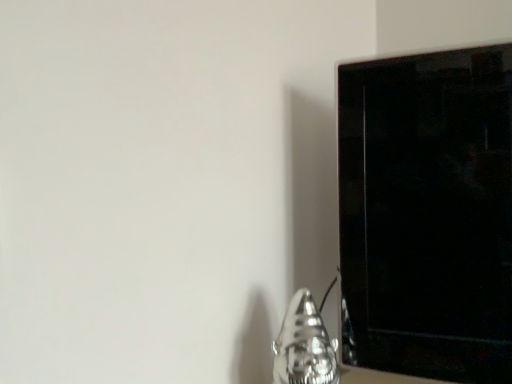
Question: Is shiny metallic gnome at lower right located within black glossy tv at right?

Choices:
 (A) no
 (B) yes

Answer: (A)

Question: Does black glossy tv at right turn towards shiny metallic gnome at lower right?

Choices:
 (A) no
 (B) yes

Answer: (B)

Question: Is black glossy tv at right further to camera compared to shiny metallic gnome at lower right?

Choices:
 (A) yes
 (B) no

Answer: (A)

Question: Can you confirm if black glossy tv at right is positioned to the left of shiny metallic gnome at lower right?

Choices:
 (A) yes
 (B) no

Answer: (B)

Question: Considering the relative sizes of black glossy tv at right and shiny metallic gnome at lower right in the image provided, is black glossy tv at right shorter than shiny metallic gnome at lower right?

Choices:
 (A) yes
 (B) no

Answer: (B)

Question: Considering the relative sizes of black glossy tv at right and shiny metallic gnome at lower right in the image provided, is black glossy tv at right smaller than shiny metallic gnome at lower right?

Choices:
 (A) yes
 (B) no

Answer: (B)

Question: Is shiny metallic gnome at lower right at the right side of black glossy tv at right?

Choices:
 (A) yes
 (B) no

Answer: (B)

Question: Is shiny metallic gnome at lower right positioned with its back to black glossy tv at right?

Choices:
 (A) yes
 (B) no

Answer: (A)

Question: Is shiny metallic gnome at lower right shorter than black glossy tv at right?

Choices:
 (A) yes
 (B) no

Answer: (A)

Question: Does shiny metallic gnome at lower right have a greater height compared to black glossy tv at right?

Choices:
 (A) no
 (B) yes

Answer: (A)

Question: Can we say shiny metallic gnome at lower right lies outside black glossy tv at right?

Choices:
 (A) yes
 (B) no

Answer: (A)

Question: Is shiny metallic gnome at lower right further to the viewer compared to black glossy tv at right?

Choices:
 (A) no
 (B) yes

Answer: (A)

Question: From their relative heights in the image, would you say shiny metallic gnome at lower right is taller or shorter than black glossy tv at right?

Choices:
 (A) tall
 (B) short

Answer: (B)